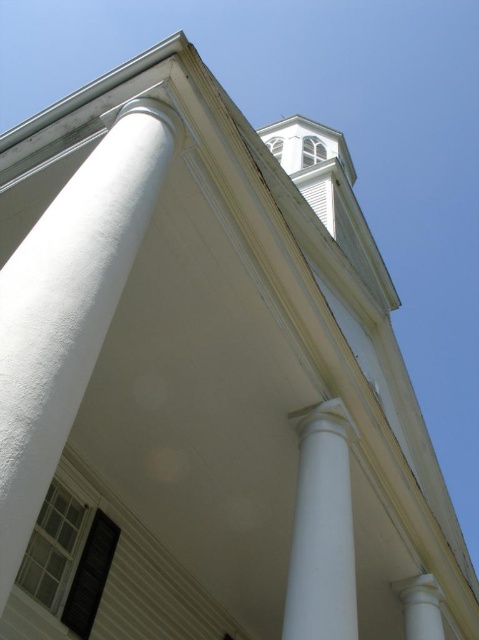
Question: Which of the following is the closest to the observer?

Choices:
 (A) (411, 625)
 (B) (320, 595)
 (C) (8, 321)

Answer: (C)

Question: Can you confirm if white smooth column at left is positioned above white smooth column at center?

Choices:
 (A) yes
 (B) no

Answer: (A)

Question: Estimate the real-world distances between objects in this image. Which object is farther from the white smooth column at left?

Choices:
 (A) white smooth column at lower right
 (B) white smooth column at center

Answer: (A)

Question: Is white smooth column at left thinner than white smooth column at center?

Choices:
 (A) yes
 (B) no

Answer: (A)

Question: Does white smooth column at center have a greater width compared to white smooth column at lower right?

Choices:
 (A) no
 (B) yes

Answer: (B)

Question: Which of the following is the farthest from the observer?

Choices:
 (A) white smooth column at lower right
 (B) white smooth column at left

Answer: (A)